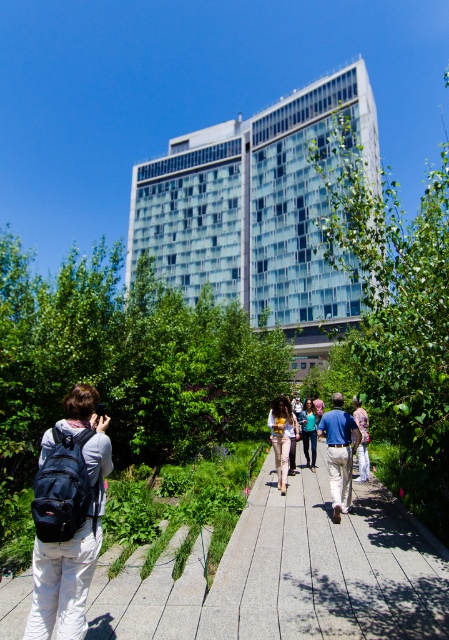
Is matte black backpack at lower left above blue denim jeans at center?

Correct, matte black backpack at lower left is located above blue denim jeans at center.

The height and width of the screenshot is (640, 449). What do you see at coordinates (61, 488) in the screenshot?
I see `matte black backpack at lower left` at bounding box center [61, 488].

Who is more distant from viewer, (x=43, y=500) or (x=366, y=470)?

The point (x=366, y=470) is behind.

Image resolution: width=449 pixels, height=640 pixels. Identify the location of matte black backpack at lower left. (61, 488).

Between blue denim jacket at center and blue denim jeans at center, which one has less height?

Standing shorter between the two is blue denim jeans at center.

Which is behind, point (335, 496) or point (357, 412)?

The point (357, 412) is behind.

Find the location of a particular element. This screenshot has height=640, width=449. blue denim jacket at center is located at coordinates (338, 452).

Does matte black backpack at lower left appear on the left side of blue denim jacket at center?

Yes, matte black backpack at lower left is to the left of blue denim jacket at center.

Between point (83, 516) and point (337, 417), which one is positioned behind?

The point (337, 417) is behind.

Identify the location of matte black backpack at lower left. Image resolution: width=449 pixels, height=640 pixels. (61, 488).